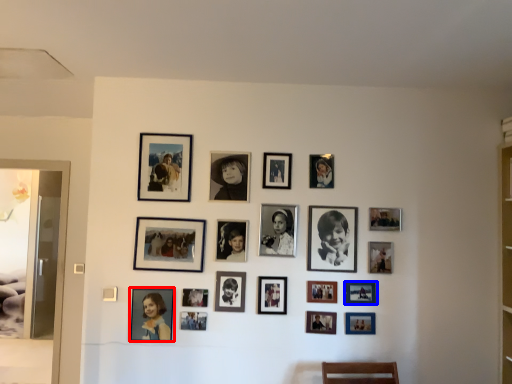
Question: Which object is further to the camera taking this photo, picture frame (highlighted by a red box) or picture frame (highlighted by a blue box)?

Choices:
 (A) picture frame
 (B) picture frame

Answer: (B)